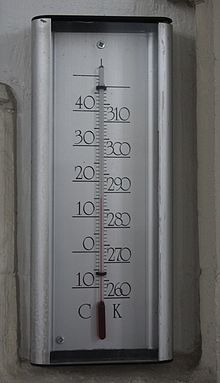
You are a GUI agent. You are given a task and a screenshot of the screen. Output one action in this format:
    pyautogui.click(x=<x>, y=<y>)
    Task: Click on the bracket
    This screenshot has width=220, height=383.
    Given the screenshot: What is the action you would take?
    pyautogui.click(x=115, y=77), pyautogui.click(x=100, y=87)